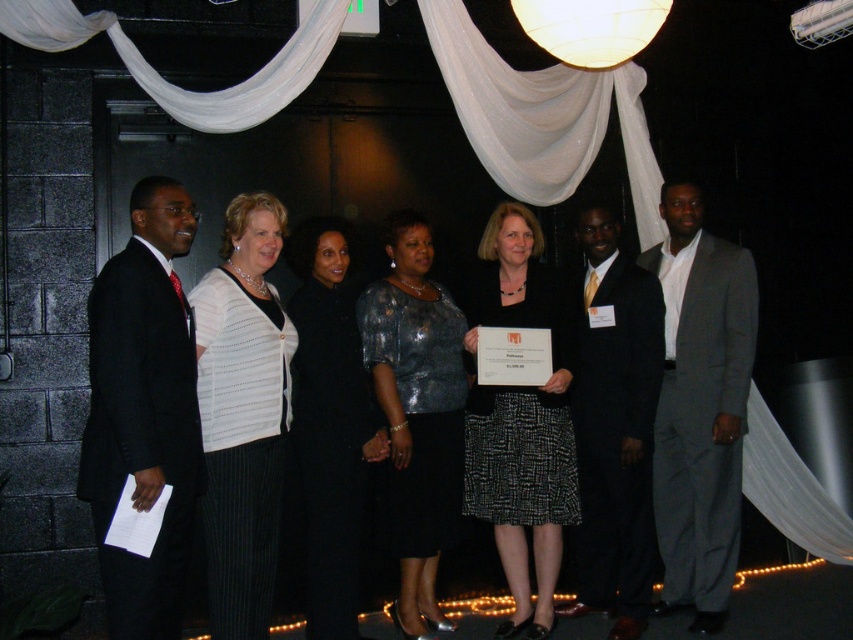
You are a photographer adjusting the lighting for the group photo. The black suit at left and the black textured skirt at center are both in shadow. You have a spotlight that can cover a 5 feet diameter area. Can you illuminate both objects with a single spotlight placement?

The distance between the black suit at left and the black textured skirt at center is 4.80 feet. Since the spotlight can cover 5 feet, placing it midway between them would ensure both are illuminated within the 5 feet diameter.

You are a photographer adjusting the camera focus. You need to ensure both the white textured blouse at center and the shiny black suit at center are in focus. Given their height difference, which one should you focus on first to achieve proper depth of field?

The white textured blouse at center is shorter than the shiny black suit at center, so focusing on the shiny black suit at center first would ensure both are within the depth of field range.